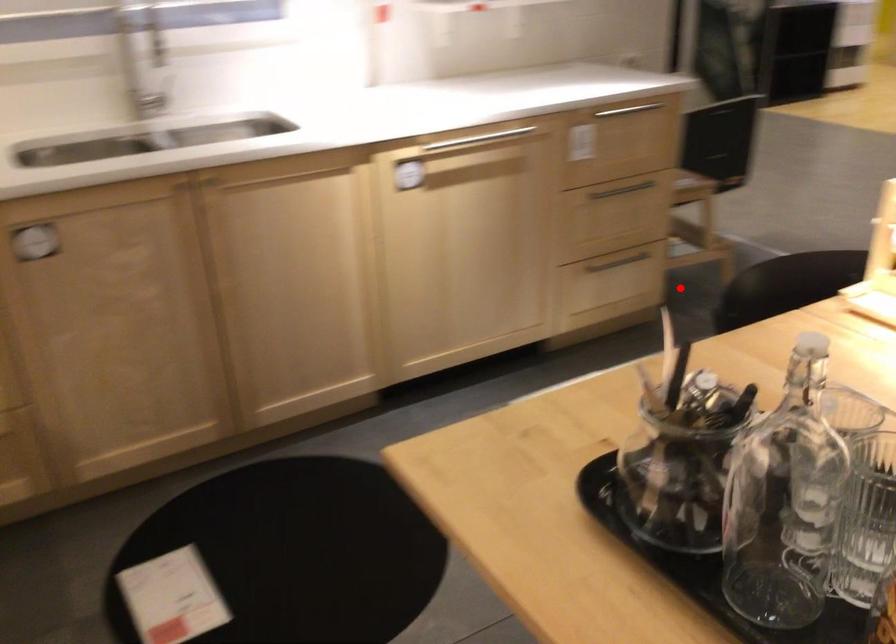
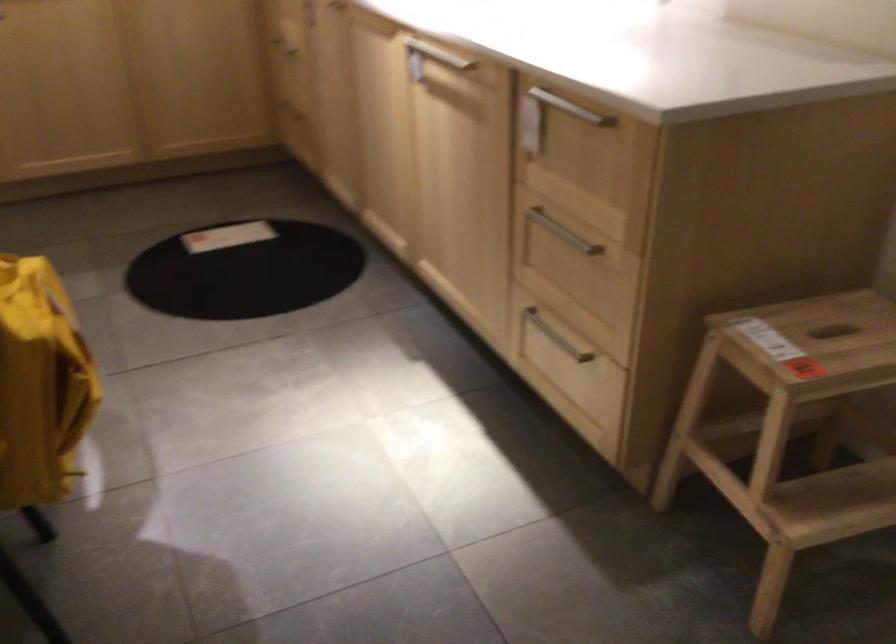
Question: I am providing you with two images of the same scene from different viewpoints. Given a red point in image1, look at the same physical point in image2. Is it:

Choices:
 (A) Closer to the viewpoint
 (B) Farther from the viewpoint

Answer: (A)